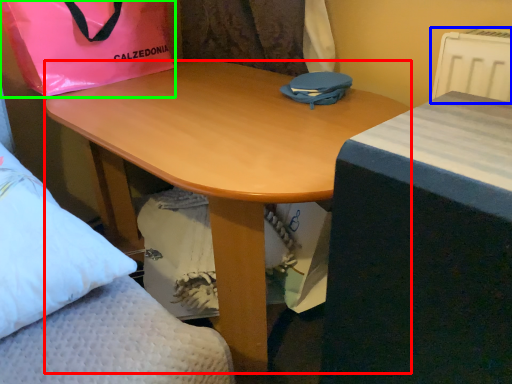
Question: Estimate the real-world distances between objects in this image. Which object is farther from desk (highlighted by a red box), radiator (highlighted by a blue box) or bag (highlighted by a green box)?

Choices:
 (A) radiator
 (B) bag

Answer: (A)